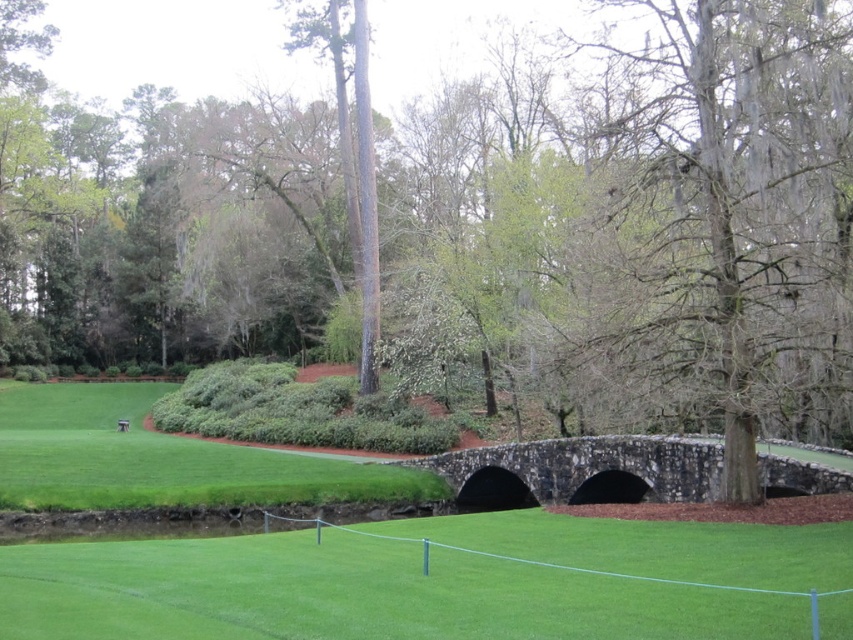
You are standing at the point marked by coordinates (x=434, y=582) in the image. What object is exactly at that location?

The green smooth grass at center is located at point (x=434, y=582).

You are standing at the point labeled as point (732, 212) in the image. What is the object located exactly at this coordinate?

The point (732, 212) is located on a gray mossy tree trunk at center.